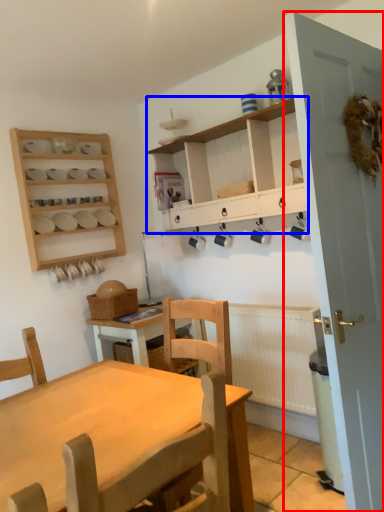
Question: Which of the following is the farthest to the observer, door (highlighted by a red box) or cabinetry (highlighted by a blue box)?

Choices:
 (A) door
 (B) cabinetry

Answer: (B)